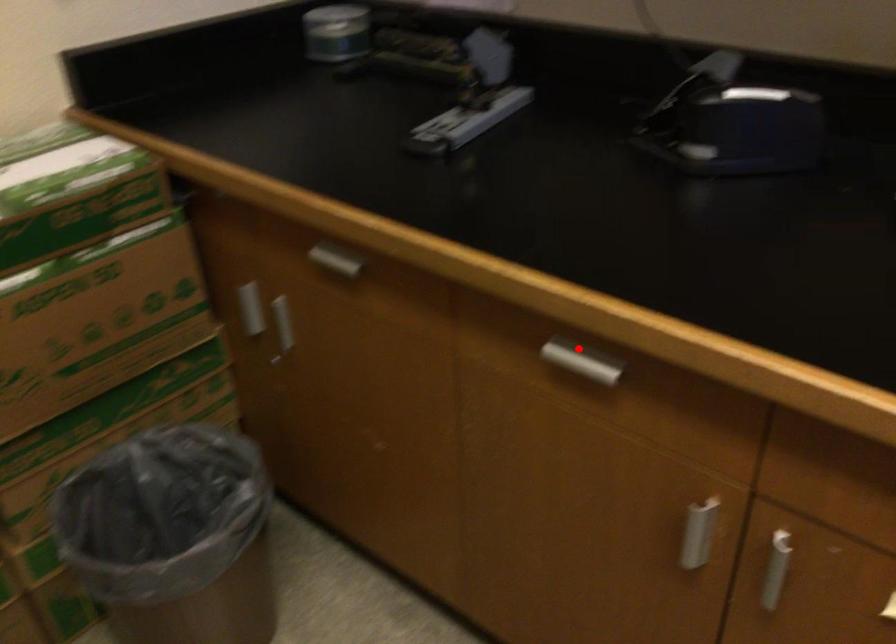
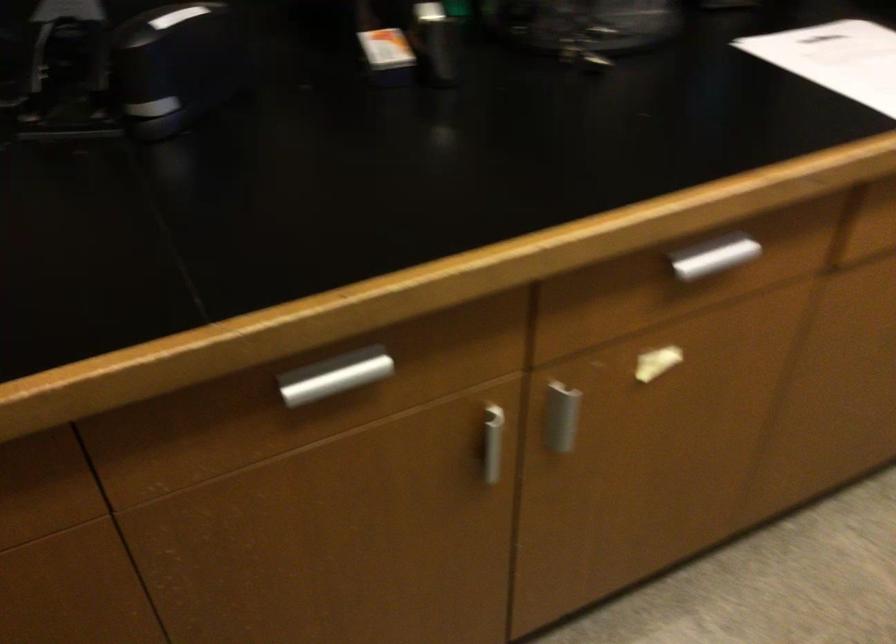
The point at the highlighted location is marked in the first image. Where is the corresponding point in the second image?

(317, 372)